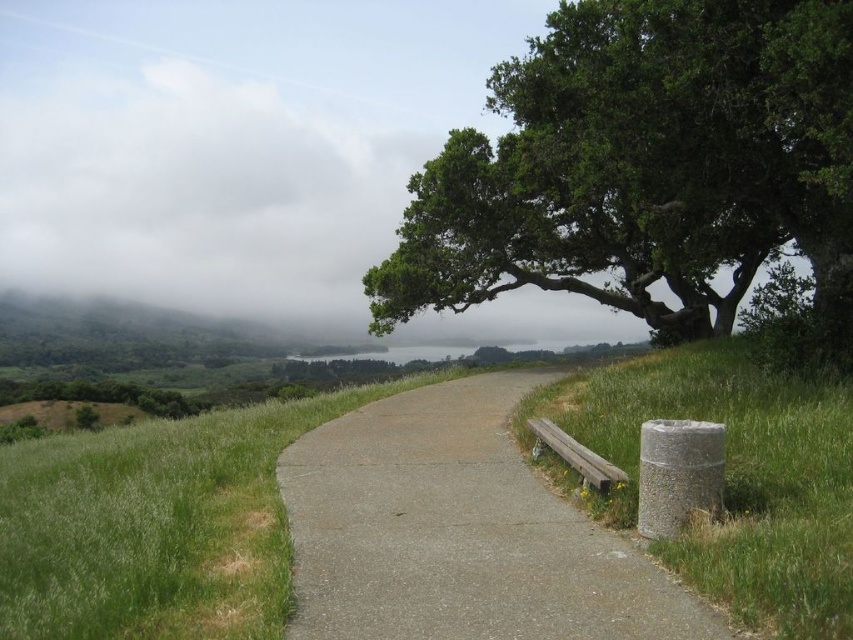
Question: Is green grassy at right above weathered wood bench at lower right?

Choices:
 (A) yes
 (B) no

Answer: (A)

Question: Which object is farther from the camera taking this photo?

Choices:
 (A) green leafy tree at upper right
 (B) weathered wood bench at lower right

Answer: (A)

Question: Is concrete at center thinner than weathered wood bench at lower right?

Choices:
 (A) no
 (B) yes

Answer: (A)

Question: Which point is closer to the camera?

Choices:
 (A) green grassy at right
 (B) white fluffy cloud at upper left

Answer: (A)

Question: Which point appears farthest from the camera in this image?

Choices:
 (A) (549, 468)
 (B) (386, 595)
 (C) (827, 333)

Answer: (C)

Question: Where is white fluffy cloud at upper left located in relation to weathered wood bench at lower right in the image?

Choices:
 (A) left
 (B) right

Answer: (A)